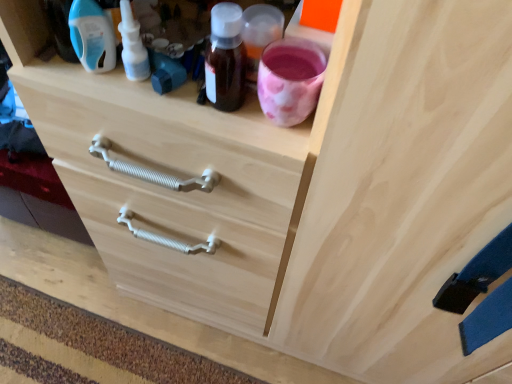
Where is `free space above natural wood drawer at center (from a real-world perspective)`? free space above natural wood drawer at center (from a real-world perspective) is located at coordinates (137, 328).